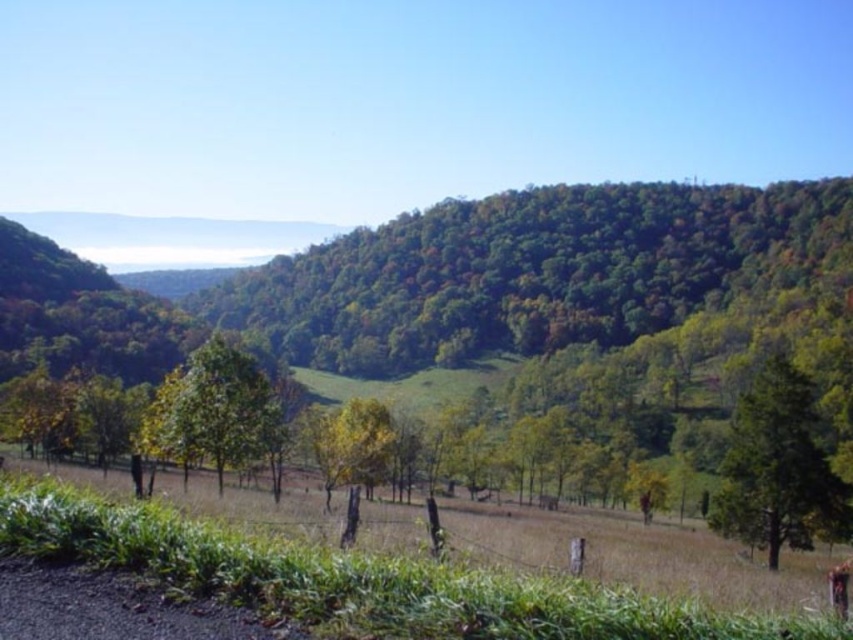
Which is in front, point (788, 420) or point (161, 385)?

Point (788, 420)

You are a GUI agent. You are given a task and a screenshot of the screen. Output one action in this format:
    pyautogui.click(x=<x>, y=<y>)
    Task: Click on the green leafy tree at lower right
    The height and width of the screenshot is (640, 853).
    Given the screenshot: What is the action you would take?
    pyautogui.click(x=778, y=468)

What do you see at coordinates (778, 468) in the screenshot?
I see `green leafy tree at lower right` at bounding box center [778, 468].

Find the location of `green leafy tree at lower right`. green leafy tree at lower right is located at coordinates (778, 468).

In the scene shown: Is green leafy tree at center below green leafy tree at lower right?

No.

Can you confirm if green leafy tree at center is smaller than green leafy tree at lower right?

No.

Is point (579, 200) positioned after point (757, 461)?

Yes, point (579, 200) is farther from viewer.

I want to click on green leafy tree at center, so [531, 269].

Does green leafy tree at center have a greater height compared to green matte tree at center?

Correct, green leafy tree at center is much taller as green matte tree at center.

Is green leafy tree at center thinner than green matte tree at center?

No.

Does point (543, 276) come closer to viewer compared to point (173, 429)?

That is False.

The height and width of the screenshot is (640, 853). In order to click on green leafy tree at center in this screenshot , I will do `click(531, 269)`.